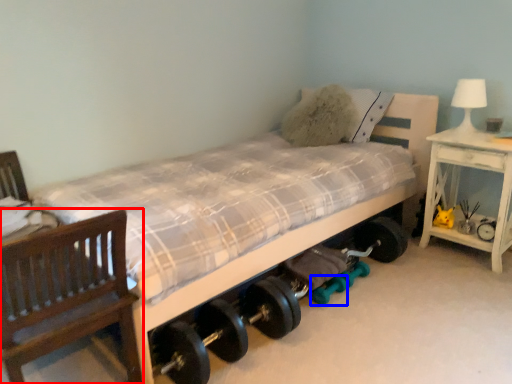
Question: Which point is closer to the camera, chair (highlighted by a red box) or dumbbell (highlighted by a blue box)?

Choices:
 (A) chair
 (B) dumbbell

Answer: (A)